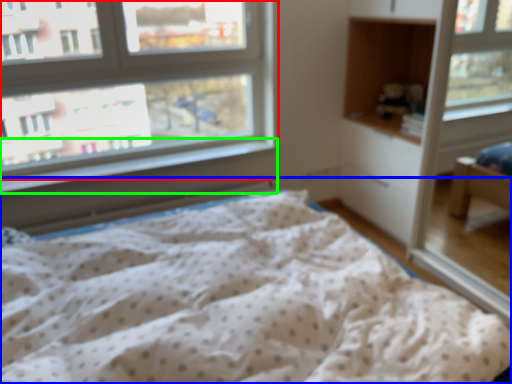
Question: Which object is the farthest from window (highlighted by a red box)? Choose among these: bed (highlighted by a blue box) or window sill (highlighted by a green box).

Choices:
 (A) bed
 (B) window sill

Answer: (A)